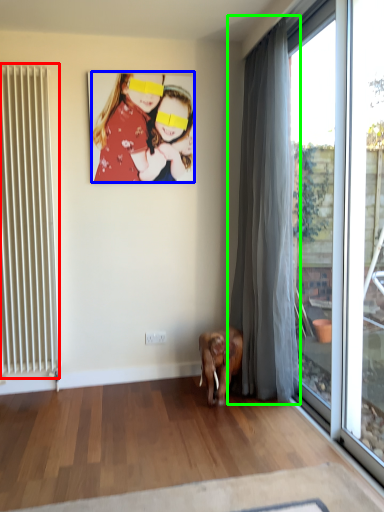
Question: Which object is the closest to the radiator (highlighted by a red box)? Choose among these: person (highlighted by a blue box) or curtain (highlighted by a green box).

Choices:
 (A) person
 (B) curtain

Answer: (A)